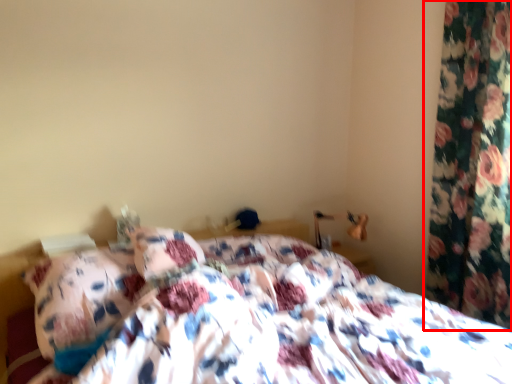
Question: Considering the relative positions of curtain (annotated by the red box) and bed in the image provided, where is curtain (annotated by the red box) located with respect to the staircase?

Choices:
 (A) right
 (B) left

Answer: (A)